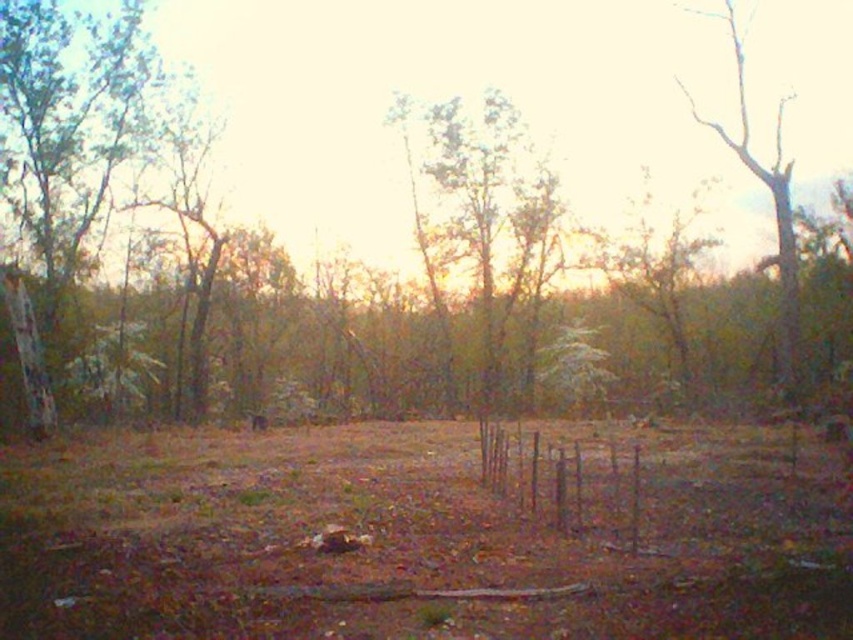
Is green leafy tree at center to the left of brown wooden fence at center from the viewer's perspective?

Correct, you'll find green leafy tree at center to the left of brown wooden fence at center.

Can you confirm if green leafy tree at center is wider than brown wooden fence at center?

Yes, green leafy tree at center is wider than brown wooden fence at center.

Does point (519, 193) lie in front of point (624, 465)?

No, it is not.

The image size is (853, 640). In order to click on green leafy tree at center in this screenshot , I will do `click(480, 209)`.

Is the position of green leafy tree at center less distant than that of bare wood tree at right?

No.

Is point (544, 269) in front of point (780, 225)?

No, (544, 269) is further to viewer.

Is point (444, 147) in front of point (798, 362)?

No, (444, 147) is behind (798, 362).

The height and width of the screenshot is (640, 853). Identify the location of green leafy tree at center. (480, 209).

Is brown wood tree at center below bare wood tree at right?

No, brown wood tree at center is not below bare wood tree at right.

The width and height of the screenshot is (853, 640). Describe the element at coordinates (463, 97) in the screenshot. I see `brown wood tree at center` at that location.

Which is behind, point (287, 198) or point (782, 161)?

Positioned behind is point (287, 198).

Where is `brown wood tree at center`? brown wood tree at center is located at coordinates (463, 97).